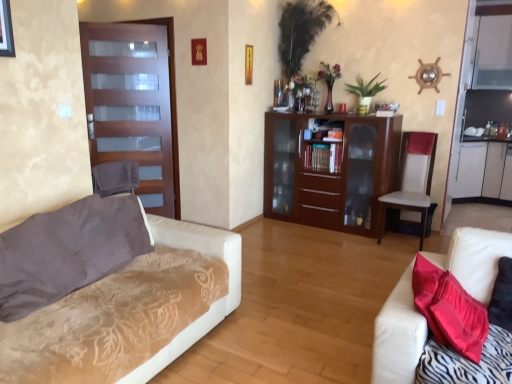
Measure the distance between point (x=305, y=175) and camera.

Point (x=305, y=175) is 4.56 meters away from camera.

What do you see at coordinates (199, 51) in the screenshot?
I see `wooden picture frame at upper center, the 2th picture frame positioned from the back` at bounding box center [199, 51].

Describe the element at coordinates (398, 335) in the screenshot. This screenshot has height=384, width=512. I see `white leather couch at lower right, which appears as the first studio couch when viewed from the right` at that location.

The width and height of the screenshot is (512, 384). What do you see at coordinates (130, 312) in the screenshot? I see `white textured couch at left, which ranks as the 1th studio couch in left-to-right order` at bounding box center [130, 312].

Where is `green glossy vase at upper center`? green glossy vase at upper center is located at coordinates (365, 91).

Locate an element on the screen. metallic gold picture frame at upper center, arranged as the 2th picture frame when viewed from the left is located at coordinates (248, 64).

You are a GUI agent. You are given a task and a screenshot of the screen. Output one action in this format:
    pyautogui.click(x=<x>, y=<y>)
    Task: Click on the brown wood cabinet at center
    This screenshot has height=384, width=512.
    Given the screenshot: What is the action you would take?
    pyautogui.click(x=329, y=169)

Is white leather couch at lower right, which is the second studio couch from left to right, facing away from wooden picture frame at upper center, the second picture frame in the right-to-left sequence?

No, white leather couch at lower right, which is the second studio couch from left to right, is not facing the opposite direction of wooden picture frame at upper center, the second picture frame in the right-to-left sequence.

Does point (473, 296) lie behind point (204, 47)?

No.

Can you confirm if white leather couch at lower right, which appears as the first studio couch when viewed from the right, is smaller than wooden picture frame at upper center, the second picture frame in the right-to-left sequence?

No.

Are white leather couch at lower right, which appears as the first studio couch when viewed from the right, and wooden picture frame at upper center, which is counted as the 1th picture frame, starting from the front, making contact?

white leather couch at lower right, which appears as the first studio couch when viewed from the right, and wooden picture frame at upper center, which is counted as the 1th picture frame, starting from the front, are clearly separated.

Which is behind, velvet brown pillow at left or green glossy vase at upper center?

green glossy vase at upper center.

Consider the image. From the image's perspective, which is below, velvet brown pillow at left or green glossy vase at upper center?

From the image's view, velvet brown pillow at left is below.

Does velvet brown pillow at left appear on the left side of green glossy vase at upper center?

Yes, velvet brown pillow at left is to the left of green glossy vase at upper center.

Considering the sizes of velvet brown pillow at left and green glossy vase at upper center in the image, is velvet brown pillow at left wider or thinner than green glossy vase at upper center?

In the image, velvet brown pillow at left appears to be wider than green glossy vase at upper center.

Between velvet brown pillow at left and brown wood cabinet at center, which one has more height?

brown wood cabinet at center is taller.

The image size is (512, 384). What are the coordinates of `cabinetry on the right of velvet brown pillow at left` in the screenshot? It's located at (329, 169).

From the image's perspective, is velvet brown pillow at left beneath brown wood cabinet at center?

Correct, velvet brown pillow at left appears lower than brown wood cabinet at center in the image.

In the scene shown: Choose the correct answer: Is velvet brown pillow at left inside brown wood cabinet at center or outside it?

velvet brown pillow at left is outside brown wood cabinet at center.

Consider the image. From the image's perspective, who appears lower, matte glass door at left or white textured couch at left, placed as the second studio couch when sorted from right to left?

white textured couch at left, placed as the second studio couch when sorted from right to left, appears lower in the image.

Can you confirm if matte glass door at left is bigger than white textured couch at left, placed as the second studio couch when sorted from right to left?

No, matte glass door at left is not bigger than white textured couch at left, placed as the second studio couch when sorted from right to left.

Could you measure the distance between matte glass door at left and white textured couch at left, placed as the second studio couch when sorted from right to left?

matte glass door at left is 6.73 feet away from white textured couch at left, placed as the second studio couch when sorted from right to left.

Locate an element on the screen. door that is above the white textured couch at left, placed as the second studio couch when sorted from right to left (from a real-world perspective) is located at coordinates (134, 104).

Can you confirm if brown wood cabinet at center is wider than metallic gold picture frame at upper center, the first picture frame when ordered from right to left?

Correct, the width of brown wood cabinet at center exceeds that of metallic gold picture frame at upper center, the first picture frame when ordered from right to left.

Looking at the image, does brown wood cabinet at center seem bigger or smaller compared to metallic gold picture frame at upper center, the first picture frame when ordered from right to left?

brown wood cabinet at center is bigger than metallic gold picture frame at upper center, the first picture frame when ordered from right to left.

In terms of height, does brown wood cabinet at center look taller or shorter compared to metallic gold picture frame at upper center, the 2th picture frame from the front?

Considering their sizes, brown wood cabinet at center has more height than metallic gold picture frame at upper center, the 2th picture frame from the front.

From a real-world perspective, is brown wood cabinet at center positioned under metallic gold picture frame at upper center, arranged as the 2th picture frame when viewed from the left, based on gravity?

Yes.

In the image, is white leather chair at right positioned in front of or behind brown wood cabinet at center?

Clearly, white leather chair at right is in front of brown wood cabinet at center.

In the scene shown: Can you confirm if white leather chair at right is wider than brown wood cabinet at center?

Correct, the width of white leather chair at right exceeds that of brown wood cabinet at center.

Does white leather chair at right have a smaller size compared to brown wood cabinet at center?

Yes, white leather chair at right is smaller than brown wood cabinet at center.

Is point (411, 192) positioned in front of point (370, 192)?

No, (411, 192) is further to viewer.

Which of these two, brown wood cabinet at center or velvet brown pillow at left, is bigger?

brown wood cabinet at center.

From the image's perspective, is brown wood cabinet at center above velvet brown pillow at left?

Yes, from the image's perspective, brown wood cabinet at center is on top of velvet brown pillow at left.

Is brown wood cabinet at center turned away from velvet brown pillow at left?

That's not correct — brown wood cabinet at center is not looking away from velvet brown pillow at left.

Would you say brown wood cabinet at center contains velvet brown pillow at left?

No, brown wood cabinet at center does not contain velvet brown pillow at left.

This screenshot has height=384, width=512. In order to click on studio couch on the right of wooden picture frame at upper center, which is the first picture frame in left-to-right order in this screenshot , I will do `click(398, 335)`.

Locate an element on the screen. Image resolution: width=512 pixels, height=384 pixels. pillow in front of the green glossy vase at upper center is located at coordinates (68, 251).

When comparing their distances from wooden picture frame at upper center, which is counted as the 1th picture frame, starting from the front, does white textured couch at left, placed as the second studio couch when sorted from right to left, or white leather chair at right seem closer?

white leather chair at right is closer to wooden picture frame at upper center, which is counted as the 1th picture frame, starting from the front.

Considering their positions, is white leather chair at right positioned further to wooden picture frame at upper center, which is the first picture frame in left-to-right order, than brown wood cabinet at center?

The object further to wooden picture frame at upper center, which is the first picture frame in left-to-right order, is white leather chair at right.

From the image, which object appears to be farther from white textured couch at left, placed as the second studio couch when sorted from right to left, wooden picture frame at upper center, which is the first picture frame in left-to-right order, or metallic gold picture frame at upper center, arranged as the 2th picture frame when viewed from the left?

metallic gold picture frame at upper center, arranged as the 2th picture frame when viewed from the left, is positioned further to the anchor white textured couch at left, placed as the second studio couch when sorted from right to left.

Considering their positions, is white leather couch at lower right, which is the second studio couch from left to right, positioned closer to green glossy vase at upper center than metallic gold picture frame at upper center, arranged as the 2th picture frame when viewed from the left?

metallic gold picture frame at upper center, arranged as the 2th picture frame when viewed from the left, lies closer to green glossy vase at upper center than the other object.

In the scene shown: Which object lies further to the anchor point wooden picture frame at upper center, which is counted as the 1th picture frame, starting from the front, white leather chair at right or white leather couch at lower right, which is the second studio couch from left to right?

white leather couch at lower right, which is the second studio couch from left to right, lies further to wooden picture frame at upper center, which is counted as the 1th picture frame, starting from the front, than the other object.

Estimate the real-world distances between objects in this image. Which object is closer to wooden picture frame at upper center, which is the first picture frame in left-to-right order, white leather couch at lower right, which appears as the first studio couch when viewed from the right, or brown wood cabinet at center?

brown wood cabinet at center is closer to wooden picture frame at upper center, which is the first picture frame in left-to-right order.

Based on their spatial positions, is white leather chair at right or wooden picture frame at upper center, which is counted as the 1th picture frame, starting from the front, closer to matte glass door at left?

The object closer to matte glass door at left is wooden picture frame at upper center, which is counted as the 1th picture frame, starting from the front.

Which object lies further to the anchor point white leather chair at right, white leather couch at lower right, which appears as the first studio couch when viewed from the right, or brown wood cabinet at center?

Based on the image, white leather couch at lower right, which appears as the first studio couch when viewed from the right, appears to be further to white leather chair at right.

The height and width of the screenshot is (384, 512). In order to click on cabinetry between white textured couch at left, placed as the second studio couch when sorted from right to left, and green glossy vase at upper center in the front-back direction in this screenshot , I will do `click(329, 169)`.

I want to click on cabinetry located between metallic gold picture frame at upper center, arranged as the 2th picture frame when viewed from the left, and green glossy vase at upper center in the left-right direction, so click(x=329, y=169).

I want to click on cabinetry located between white leather couch at lower right, which is the second studio couch from left to right, and wooden picture frame at upper center, the 2th picture frame positioned from the back, in the depth direction, so click(x=329, y=169).

Locate an element on the screen. pillow positioned between white textured couch at left, which ranks as the 1th studio couch in left-to-right order, and green glossy vase at upper center from near to far is located at coordinates (x=68, y=251).